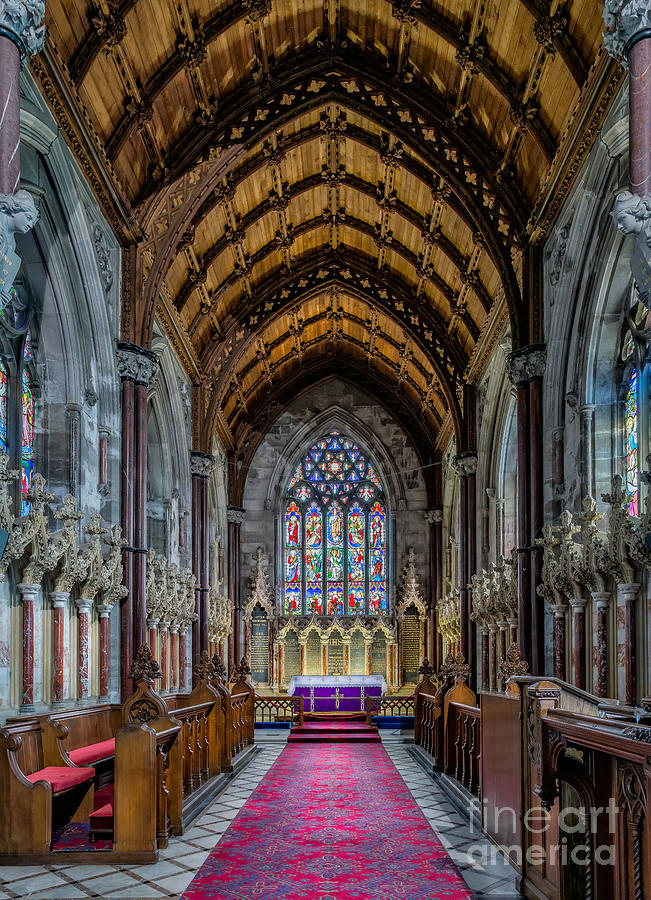
The image size is (651, 900). Find the location of `red seats on pews`. red seats on pews is located at coordinates (66, 778), (92, 749).